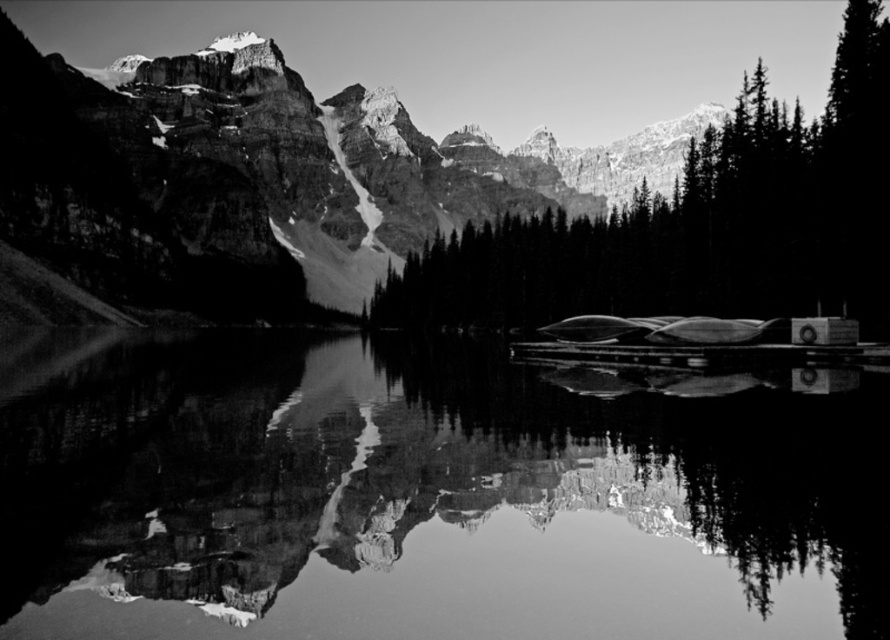
Is smooth water at center bigger than smooth dark green trees at center?

Actually, smooth water at center might be smaller than smooth dark green trees at center.

Which is behind, point (802, 572) or point (634, 276)?

Positioned behind is point (634, 276).

I want to click on smooth water at center, so click(423, 497).